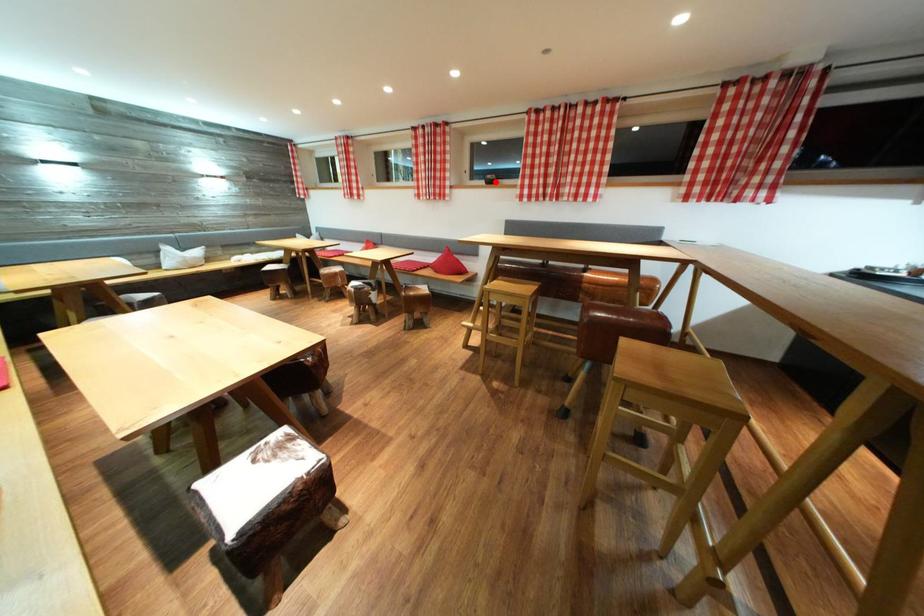
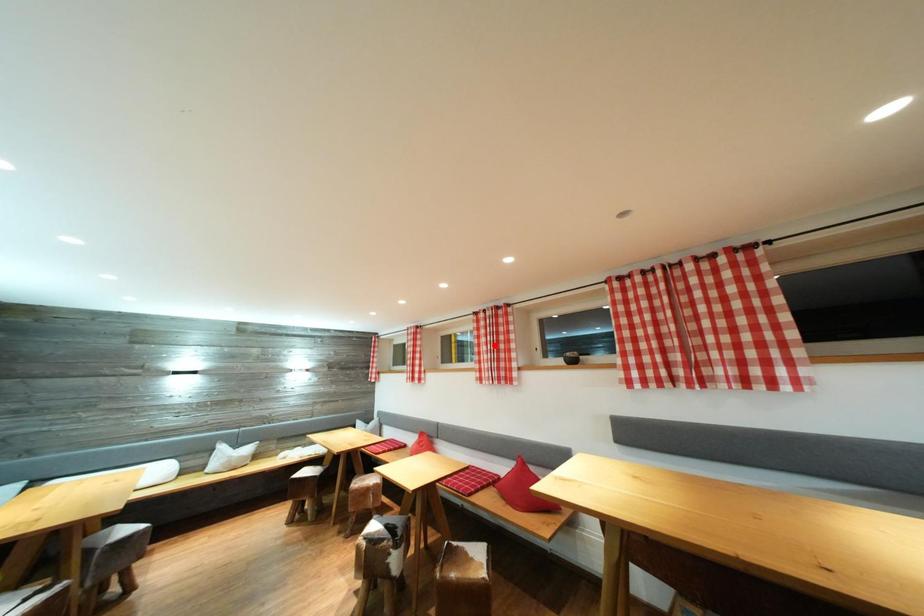
I am providing you with two images of the same scene from different viewpoints. A red point is marked on the first image and another point is marked on the second image. Is the red point in image1 aligned with the point shown in image2?

No